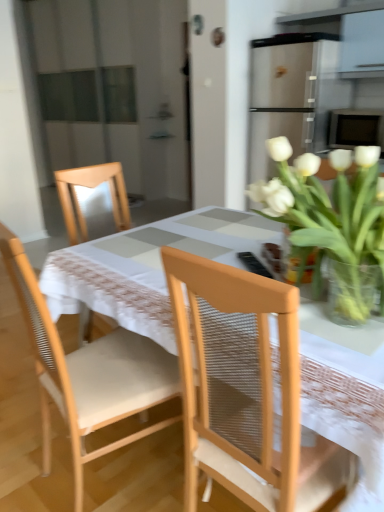
Question: Considering the relative positions of wooden chair at center, acting as the 2th chair starting from the right, and light brown woven chair at center, the 2th chair from the left, in the image provided, is wooden chair at center, acting as the 2th chair starting from the right, to the left of light brown woven chair at center, the 2th chair from the left, from the viewer's perspective?

Choices:
 (A) no
 (B) yes

Answer: (B)

Question: Considering the relative sizes of wooden chair at center, acting as the 2th chair starting from the right, and light brown woven chair at center, the first chair from the right, in the image provided, is wooden chair at center, acting as the 2th chair starting from the right, wider than light brown woven chair at center, the first chair from the right,?

Choices:
 (A) no
 (B) yes

Answer: (B)

Question: Is wooden chair at center, placed as the first chair when sorted from left to right, bigger than light brown woven chair at center, the 2th chair from the left?

Choices:
 (A) yes
 (B) no

Answer: (A)

Question: Is wooden chair at center, acting as the 2th chair starting from the right, completely or partially outside of light brown woven chair at center, the first chair from the right?

Choices:
 (A) yes
 (B) no

Answer: (A)

Question: Can you confirm if wooden chair at center, acting as the 2th chair starting from the right, is taller than light brown woven chair at center, the 2th chair from the left?

Choices:
 (A) yes
 (B) no

Answer: (B)

Question: From a real-world perspective, is wooden chair at center, acting as the 2th chair starting from the right, positioned under light brown woven chair at center, the 2th chair from the left, based on gravity?

Choices:
 (A) no
 (B) yes

Answer: (B)

Question: Is wooden chair at center, placed as the first chair when sorted from left to right, positioned far away from white fabric table at center?

Choices:
 (A) no
 (B) yes

Answer: (A)

Question: From the image's perspective, is wooden chair at center, acting as the 2th chair starting from the right, below white fabric table at center?

Choices:
 (A) yes
 (B) no

Answer: (B)

Question: Could you tell me if wooden chair at center, placed as the first chair when sorted from left to right, is turned towards white fabric table at center?

Choices:
 (A) no
 (B) yes

Answer: (B)

Question: Considering the relative sizes of wooden chair at center, placed as the first chair when sorted from left to right, and white fabric table at center in the image provided, is wooden chair at center, placed as the first chair when sorted from left to right, thinner than white fabric table at center?

Choices:
 (A) no
 (B) yes

Answer: (B)

Question: From a real-world perspective, is wooden chair at center, acting as the 2th chair starting from the right, on white fabric table at center?

Choices:
 (A) yes
 (B) no

Answer: (A)

Question: Is wooden chair at center, placed as the first chair when sorted from left to right, bigger than white fabric table at center?

Choices:
 (A) yes
 (B) no

Answer: (B)

Question: Considering the relative sizes of white fabric table at center and wooden chair at center, placed as the first chair when sorted from left to right, in the image provided, is white fabric table at center bigger than wooden chair at center, placed as the first chair when sorted from left to right,?

Choices:
 (A) no
 (B) yes

Answer: (B)